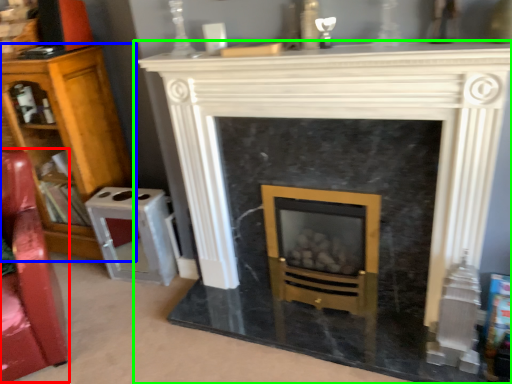
Question: Considering the real-world distances, which object is closest to swivel chair (highlighted by a red box)? bookcase (highlighted by a blue box) or fireplace (highlighted by a green box).

Choices:
 (A) bookcase
 (B) fireplace

Answer: (A)